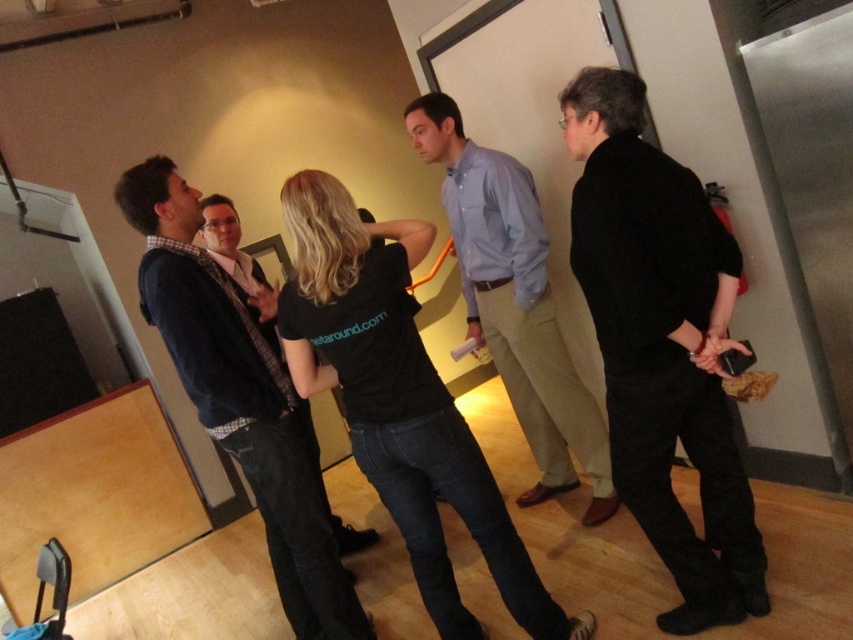
Does black cotton t-shirt at center appear under light blue shirt at center?

Indeed, black cotton t-shirt at center is positioned under light blue shirt at center.

Find the location of a particular element. This screenshot has height=640, width=853. black cotton t-shirt at center is located at coordinates (399, 403).

Find the location of a particular element. black cotton t-shirt at center is located at coordinates (x=399, y=403).

Between dark blue sweater at center and light blue shirt at center, which one is positioned lower?

dark blue sweater at center

Where is `dark blue sweater at center`? Image resolution: width=853 pixels, height=640 pixels. dark blue sweater at center is located at coordinates (241, 397).

The height and width of the screenshot is (640, 853). Find the location of `dark blue sweater at center`. dark blue sweater at center is located at coordinates (241, 397).

Does black matte pants at right have a smaller size compared to black cotton t-shirt at center?

Indeed, black matte pants at right has a smaller size compared to black cotton t-shirt at center.

Who is more distant from viewer, (657, 291) or (412, 321)?

Positioned behind is point (412, 321).

You are a GUI agent. You are given a task and a screenshot of the screen. Output one action in this format:
    pyautogui.click(x=<x>, y=<y>)
    Task: Click on the black matte pants at right
    
    Given the screenshot: What is the action you would take?
    pyautogui.click(x=662, y=346)